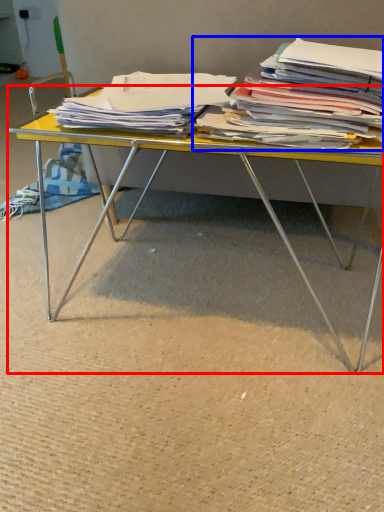
Question: Which object is further to the camera taking this photo, desk (highlighted by a red box) or magazine (highlighted by a blue box)?

Choices:
 (A) desk
 (B) magazine

Answer: (A)